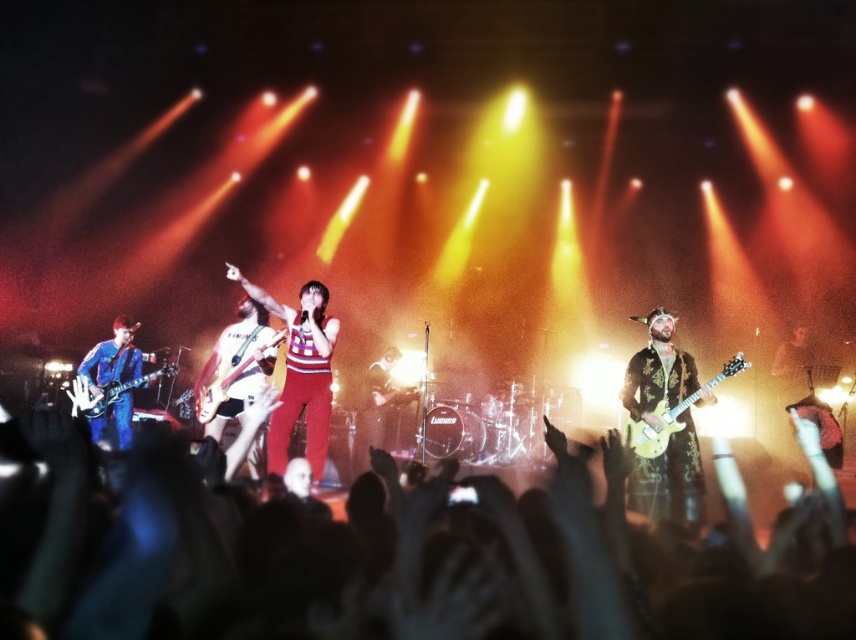
You are a photographer at the concert and want to capture a closeup of the guitars. Since your camera has a limited focus range, you need to know which guitar is thinner. Which one is thinner between the shiny gold electric guitar at right and the brushed metal guitar at left?

The shiny gold electric guitar at right is thinner than the brushed metal guitar at left according to the description.

You are a photographer at the concert. You want to take a photo where both the silky black hair at center and the shiny gold electric guitar at right are clearly visible. Which object should you focus on first to ensure both are in focus?

You should focus on the shiny gold electric guitar at right first because it is taller than the silky black hair at center, so focusing on the taller object will help ensure both are in focus.